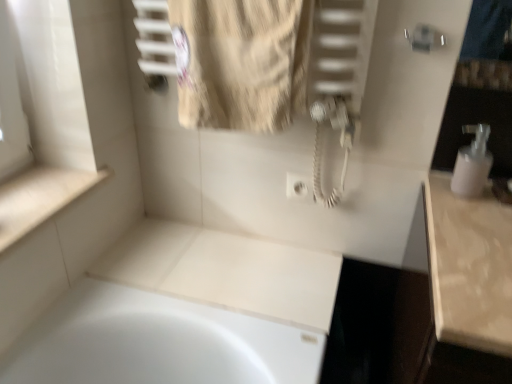
Question: Is white plastic soap dispenser at right turned away from beige textured towel at upper center?

Choices:
 (A) yes
 (B) no

Answer: (B)

Question: Are white plastic soap dispenser at right and beige textured towel at upper center making contact?

Choices:
 (A) yes
 (B) no

Answer: (B)

Question: Considering the relative sizes of white plastic soap dispenser at right and beige textured towel at upper center in the image provided, is white plastic soap dispenser at right bigger than beige textured towel at upper center?

Choices:
 (A) no
 (B) yes

Answer: (A)

Question: Does white plastic soap dispenser at right have a greater width compared to beige textured towel at upper center?

Choices:
 (A) no
 (B) yes

Answer: (A)

Question: Is white plastic soap dispenser at right far from beige textured towel at upper center?

Choices:
 (A) yes
 (B) no

Answer: (B)

Question: In terms of height, does beige textured towel at upper center look taller or shorter compared to white plastic soap dispenser at right?

Choices:
 (A) short
 (B) tall

Answer: (B)

Question: Is point (253, 59) closer or farther from the camera than point (488, 160)?

Choices:
 (A) closer
 (B) farther

Answer: (A)

Question: From the image's perspective, is beige textured towel at upper center positioned above or below white plastic soap dispenser at right?

Choices:
 (A) above
 (B) below

Answer: (A)

Question: Considering the positions of beige textured towel at upper center and white plastic soap dispenser at right in the image, is beige textured towel at upper center bigger or smaller than white plastic soap dispenser at right?

Choices:
 (A) small
 (B) big

Answer: (B)

Question: Looking at the image, does beige textured towel at upper center seem bigger or smaller compared to white glossy counter top at lower left?

Choices:
 (A) big
 (B) small

Answer: (A)

Question: Would you say beige textured towel at upper center is inside or outside white glossy counter top at lower left?

Choices:
 (A) inside
 (B) outside

Answer: (B)

Question: In the image, is beige textured towel at upper center positioned in front of or behind white glossy counter top at lower left?

Choices:
 (A) front
 (B) behind

Answer: (A)

Question: In terms of height, does beige textured towel at upper center look taller or shorter compared to white glossy counter top at lower left?

Choices:
 (A) tall
 (B) short

Answer: (A)

Question: Is white glossy counter top at lower left spatially inside beige textured towel at upper center, or outside of it?

Choices:
 (A) inside
 (B) outside

Answer: (B)

Question: Considering the positions of white glossy counter top at lower left and beige textured towel at upper center in the image, is white glossy counter top at lower left taller or shorter than beige textured towel at upper center?

Choices:
 (A) tall
 (B) short

Answer: (B)